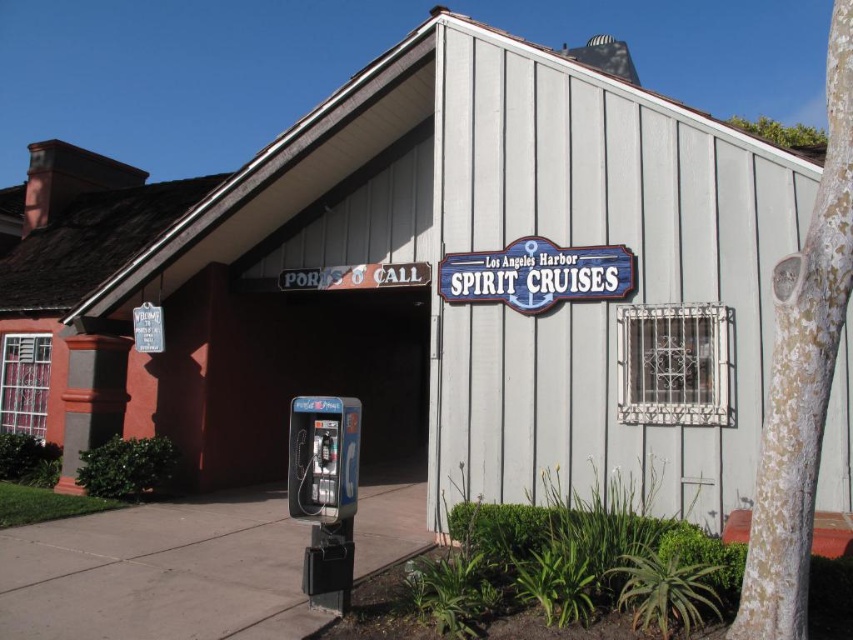
In the scene shown: Can you confirm if gray concrete sidewalk at lower left is thinner than metallic gray parking meter at lower left?

No.

Does gray concrete sidewalk at lower left have a greater width compared to metallic gray parking meter at lower left?

Indeed, gray concrete sidewalk at lower left has a greater width compared to metallic gray parking meter at lower left.

Does point (112, 618) lie in front of point (302, 428)?

Yes, point (112, 618) is in front of point (302, 428).

Find the location of a particular element. gray concrete sidewalk at lower left is located at coordinates (158, 573).

Is gray concrete sidewalk at lower left wider than blue wooden sign at upper center?

Correct, the width of gray concrete sidewalk at lower left exceeds that of blue wooden sign at upper center.

Does point (236, 593) come farther from viewer compared to point (618, 259)?

That is False.

Locate an element on the screen. The width and height of the screenshot is (853, 640). gray concrete sidewalk at lower left is located at coordinates (158, 573).

Measure the distance from metallic gray parking meter at lower left to blue wooden sign at upper center.

The distance of metallic gray parking meter at lower left from blue wooden sign at upper center is 2.95 meters.

What do you see at coordinates (325, 492) in the screenshot? I see `metallic gray parking meter at lower left` at bounding box center [325, 492].

Between point (316, 458) and point (454, 257), which one is positioned in front?

Point (316, 458)

You are a GUI agent. You are given a task and a screenshot of the screen. Output one action in this format:
    pyautogui.click(x=<x>, y=<y>)
    Task: Click on the metallic gray parking meter at lower left
    The width and height of the screenshot is (853, 640).
    Given the screenshot: What is the action you would take?
    pyautogui.click(x=325, y=492)